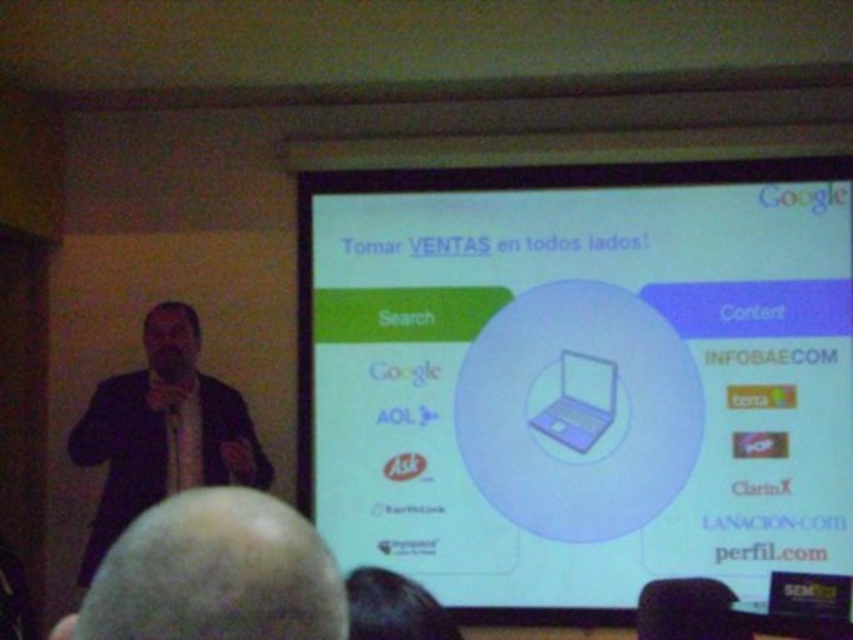
You are a presenter standing at the speaker position on the left side of the frame. You need to place your white glossy laptop at center on the table in front of you. Where should you place it?

You should place the white glossy laptop at center at the coordinates point (578,378).